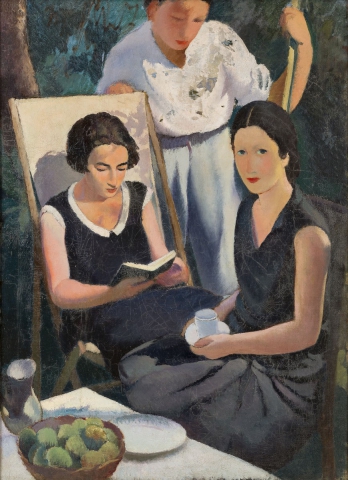
Image resolution: width=348 pixels, height=480 pixels. I want to click on book, so click(x=152, y=271).